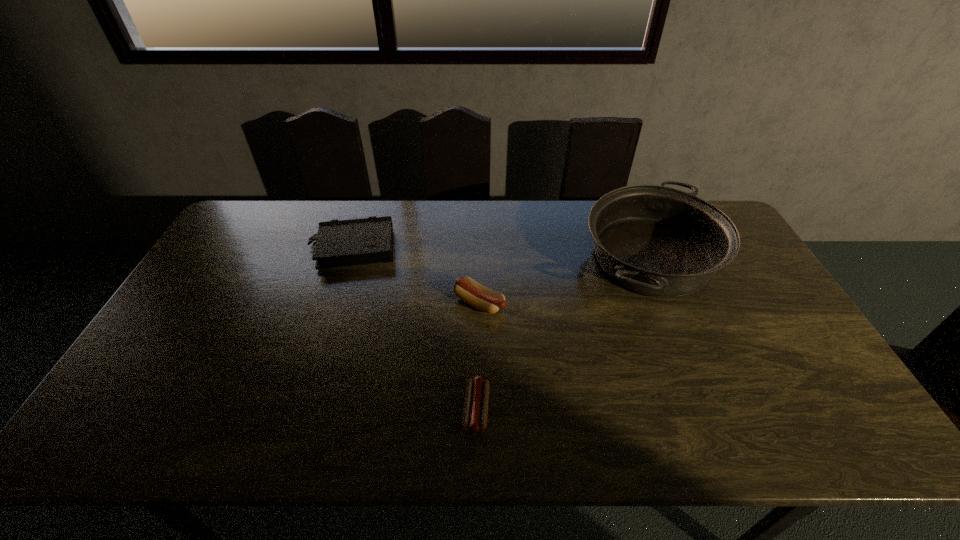
In order to click on pan that is at the far edge in this screenshot , I will do tap(658, 241).

Locate an element on the screen. The image size is (960, 540). Bible that is at the far edge is located at coordinates (369, 240).

Find the location of a particular element. The width and height of the screenshot is (960, 540). object that is at the near edge is located at coordinates (475, 413).

Locate an element on the screen. The width and height of the screenshot is (960, 540). object located at the right edge is located at coordinates (658, 241).

The width and height of the screenshot is (960, 540). I want to click on object present at the far right corner, so click(x=658, y=241).

You are a GUI agent. You are given a task and a screenshot of the screen. Output one action in this format:
    pyautogui.click(x=<x>, y=<y>)
    Task: Click on the vacant region at the far edge
    This screenshot has height=540, width=960.
    Given the screenshot: What is the action you would take?
    pyautogui.click(x=474, y=204)

I want to click on vacant space at the left edge, so click(x=223, y=261).

In the image, there is a desktop. Identify the location of vacant space at the right edge. This screenshot has height=540, width=960. (820, 410).

Identify the location of free region at the far left corner of the desktop. Image resolution: width=960 pixels, height=540 pixels. (271, 224).

Image resolution: width=960 pixels, height=540 pixels. In order to click on free space between the nearer sausage and the farther sausage in this screenshot , I will do `click(478, 356)`.